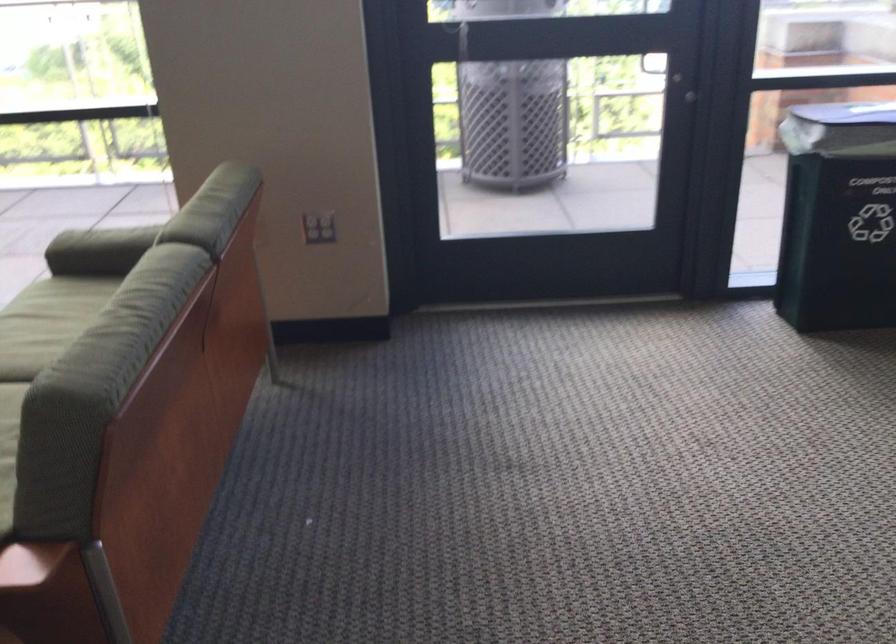
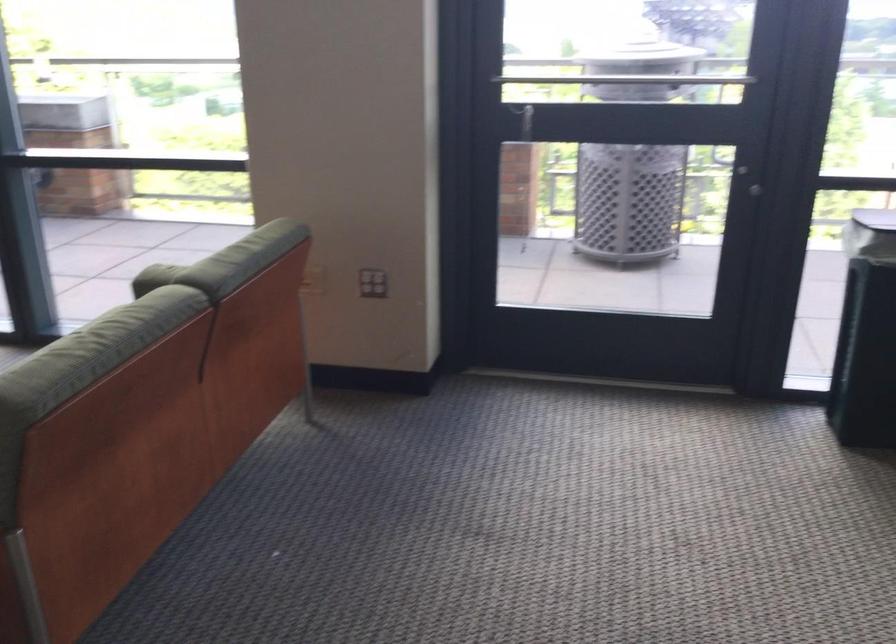
Question: The camera is either moving clockwise (left) or counter-clockwise (right) around the object. The first image is from the beginning of the video and the second image is from the end. Is the camera moving left or right when shooting the video?

Choices:
 (A) Left
 (B) Right

Answer: (B)